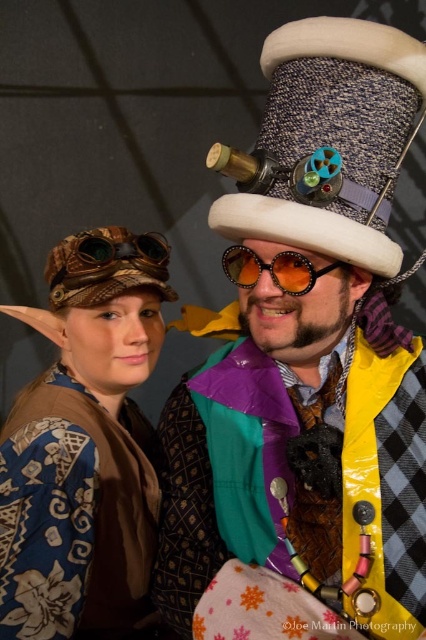
You are standing in front of the two costumed individuals. The steampunk hat at center is located at point [311,352]. Can you determine if the steampunk hat at center is positioned to the left or right of the person on the left?

The steampunk hat at center is located at point [311,352], which is to the right of the person on the left.

You are a photographer setting up for a group photo. You notice the blue fabric hat at upper left and the shiny orange sunglasses at center. Which object is positioned lower in the image?

The blue fabric hat at upper left is located below the shiny orange sunglasses at center, so it is positioned lower in the image.